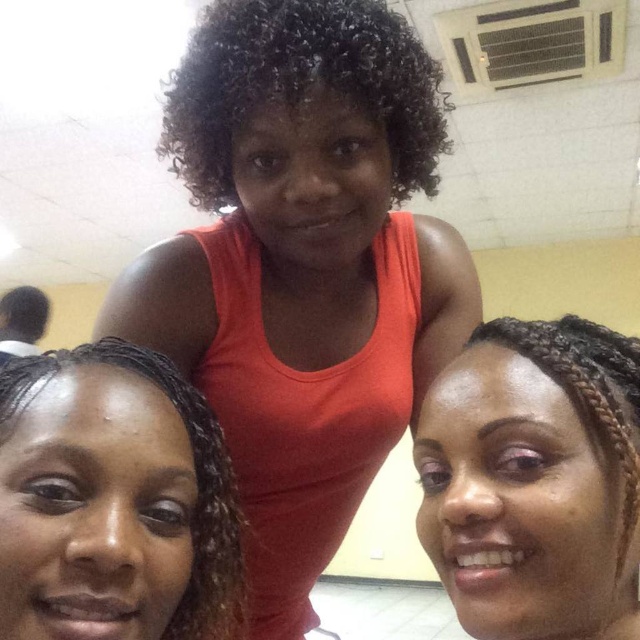
Question: Is curly dark brown hair at center positioned in front of black braided hair at lower right?

Choices:
 (A) no
 (B) yes

Answer: (A)

Question: Is orange matte tank top at center above curly dark brown hair at center?

Choices:
 (A) yes
 (B) no

Answer: (B)

Question: Among these objects, which one is nearest to the camera?

Choices:
 (A) curly dark brown hair at center
 (B) orange matte tank top at center
 (C) black braided hair at lower left

Answer: (C)

Question: Which of the following is the closest to the observer?

Choices:
 (A) curly dark brown hair at center
 (B) orange matte tank top at center

Answer: (A)

Question: Can you confirm if orange matte tank top at center is positioned above curly dark brown hair at center?

Choices:
 (A) yes
 (B) no

Answer: (B)

Question: Considering the real-world distances, which object is closest to the curly dark brown hair at center?

Choices:
 (A) black braided hair at lower right
 (B) orange matte tank top at center
 (C) black braided hair at lower left

Answer: (B)